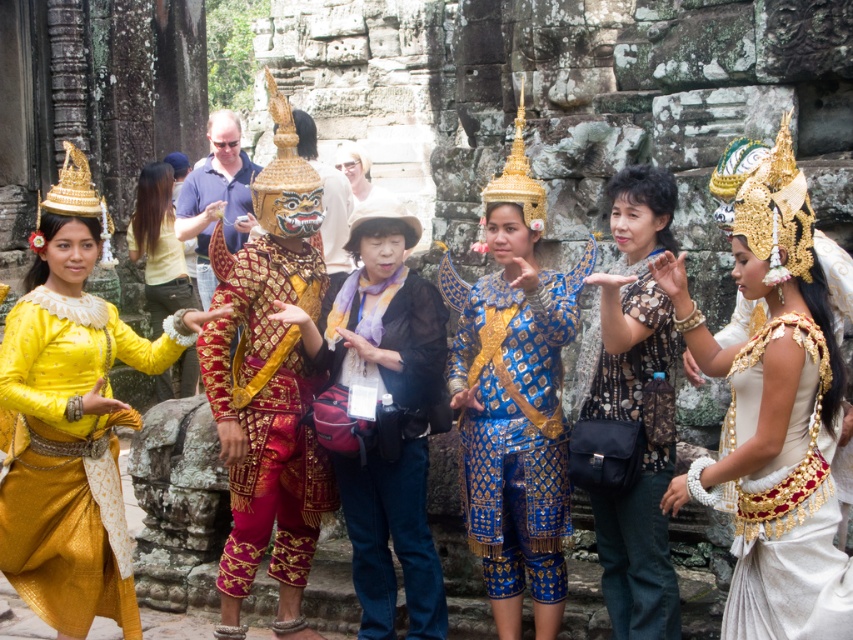
Who is more forward, (x=289, y=529) or (x=361, y=150)?

Positioned in front is point (x=289, y=529).

Is gold brocade mask at center below light beige fabric at center?

Yes.

Between point (281, 200) and point (355, 145), which one is positioned in front?

Point (281, 200) is in front.

Locate an element on the screen. gold brocade mask at center is located at coordinates (270, 394).

How much distance is there between purple fabric scarf at center and yellow fabric at left?

purple fabric scarf at center and yellow fabric at left are 25.97 meters apart.

I want to click on purple fabric scarf at center, so click(x=399, y=419).

This screenshot has width=853, height=640. Find the location of `purple fabric scarf at center`. purple fabric scarf at center is located at coordinates (399, 419).

Can you confirm if matte gold costume at left is thinner than gold brocade mask at center?

No, matte gold costume at left is not thinner than gold brocade mask at center.

At what (x,y) coordinates should I click in order to perform the action: click on matte gold costume at left. Please return your answer as a coordinate pair (x, y). Looking at the image, I should click on (71, 420).